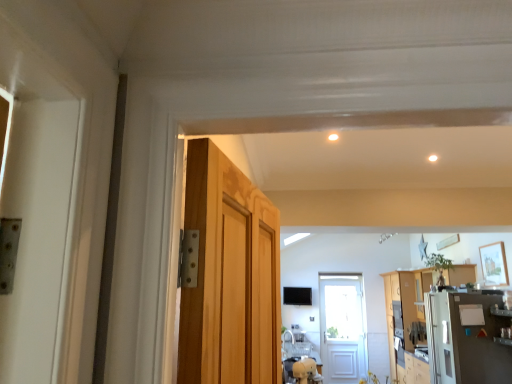
Question: Is wooden cabinet at right not close to satin silver refrigerator at right?

Choices:
 (A) no
 (B) yes

Answer: (A)

Question: Is wooden cabinet at right oriented towards satin silver refrigerator at right?

Choices:
 (A) yes
 (B) no

Answer: (B)

Question: From the image's perspective, is wooden cabinet at right beneath satin silver refrigerator at right?

Choices:
 (A) yes
 (B) no

Answer: (A)

Question: Is wooden cabinet at right closer to the viewer compared to satin silver refrigerator at right?

Choices:
 (A) no
 (B) yes

Answer: (A)

Question: Is satin silver refrigerator at right surrounded by wooden cabinet at right?

Choices:
 (A) yes
 (B) no

Answer: (B)

Question: From a real-world perspective, is satin silver refrigerator at right positioned above or below wooden cabinet at right?

Choices:
 (A) below
 (B) above

Answer: (B)

Question: Considering the relative positions of satin silver refrigerator at right and wooden cabinet at right in the image provided, is satin silver refrigerator at right to the left or to the right of wooden cabinet at right?

Choices:
 (A) right
 (B) left

Answer: (B)

Question: Do you think satin silver refrigerator at right is within wooden cabinet at right, or outside of it?

Choices:
 (A) outside
 (B) inside

Answer: (A)

Question: Considering the positions of satin silver refrigerator at right and wooden cabinet at right in the image, is satin silver refrigerator at right taller or shorter than wooden cabinet at right?

Choices:
 (A) tall
 (B) short

Answer: (B)

Question: From the image's perspective, is wooden cabinet at right above or below white glossy light at upper center?

Choices:
 (A) below
 (B) above

Answer: (A)

Question: From a real-world perspective, is wooden cabinet at right physically located above or below white glossy light at upper center?

Choices:
 (A) above
 (B) below

Answer: (B)

Question: Is wooden cabinet at right taller or shorter than white glossy light at upper center?

Choices:
 (A) short
 (B) tall

Answer: (B)

Question: Relative to white glossy light at upper center, is wooden cabinet at right in front or behind?

Choices:
 (A) behind
 (B) front

Answer: (A)

Question: Is satin silver refrigerator at right in front of or behind white glossy light at upper center in the image?

Choices:
 (A) behind
 (B) front

Answer: (A)

Question: Is satin silver refrigerator at right wider or thinner than white glossy light at upper center?

Choices:
 (A) thin
 (B) wide

Answer: (B)